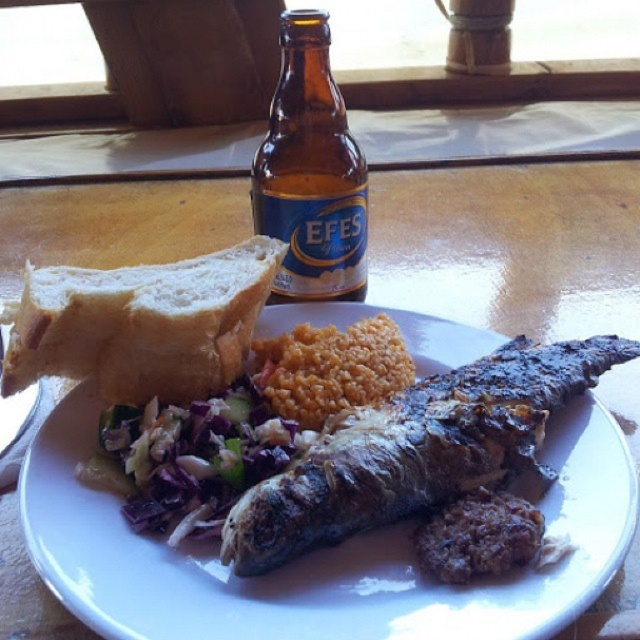
Question: Is white soft bread at upper left closer to the viewer compared to brown rice at center?

Choices:
 (A) yes
 (B) no

Answer: (A)

Question: Considering the relative positions of white ceramic plate at center and brown glass bottle at upper center in the image provided, where is white ceramic plate at center located with respect to brown glass bottle at upper center?

Choices:
 (A) above
 (B) below

Answer: (B)

Question: Which is nearer to the white ceramic plate at center?

Choices:
 (A) brown rice at center
 (B) white soft bread at upper left
 (C) shredded purple cabbage at center

Answer: (C)

Question: Which point is farther from the camera taking this photo?

Choices:
 (A) (141, 483)
 (B) (316, 74)
 (C) (301, 355)

Answer: (B)

Question: Which object is farther from the camera taking this photo?

Choices:
 (A) brown glass bottle at upper center
 (B) white soft bread at upper left
 (C) white ceramic plate at center

Answer: (A)

Question: Does brown glass bottle at upper center appear under brown rice at center?

Choices:
 (A) yes
 (B) no

Answer: (B)